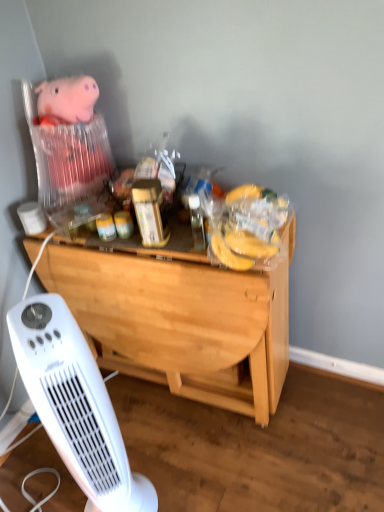
Question: Does light wood desk at center have a smaller size compared to white plastic heater at lower left?

Choices:
 (A) yes
 (B) no

Answer: (B)

Question: Is light wood desk at center oriented away from white plastic heater at lower left?

Choices:
 (A) yes
 (B) no

Answer: (A)

Question: Is light wood desk at center thinner than white plastic heater at lower left?

Choices:
 (A) no
 (B) yes

Answer: (A)

Question: Does light wood desk at center appear on the left side of white plastic heater at lower left?

Choices:
 (A) yes
 (B) no

Answer: (B)

Question: From the image's perspective, does light wood desk at center appear lower than white plastic heater at lower left?

Choices:
 (A) yes
 (B) no

Answer: (B)

Question: Is light wood desk at center positioned beyond the bounds of white plastic heater at lower left?

Choices:
 (A) no
 (B) yes

Answer: (B)

Question: Is light wood desk at center wider than plush pink pig at upper left?

Choices:
 (A) no
 (B) yes

Answer: (B)

Question: Does light wood desk at center have a larger size compared to plush pink pig at upper left?

Choices:
 (A) yes
 (B) no

Answer: (A)

Question: From the image's perspective, is light wood desk at center above plush pink pig at upper left?

Choices:
 (A) no
 (B) yes

Answer: (A)

Question: From the image's perspective, is light wood desk at center beneath plush pink pig at upper left?

Choices:
 (A) yes
 (B) no

Answer: (A)

Question: Is light wood desk at center behind plush pink pig at upper left?

Choices:
 (A) no
 (B) yes

Answer: (A)

Question: Is light wood desk at center oriented away from plush pink pig at upper left?

Choices:
 (A) no
 (B) yes

Answer: (A)

Question: Is white plastic heater at lower left in contact with light wood desk at center?

Choices:
 (A) yes
 (B) no

Answer: (B)